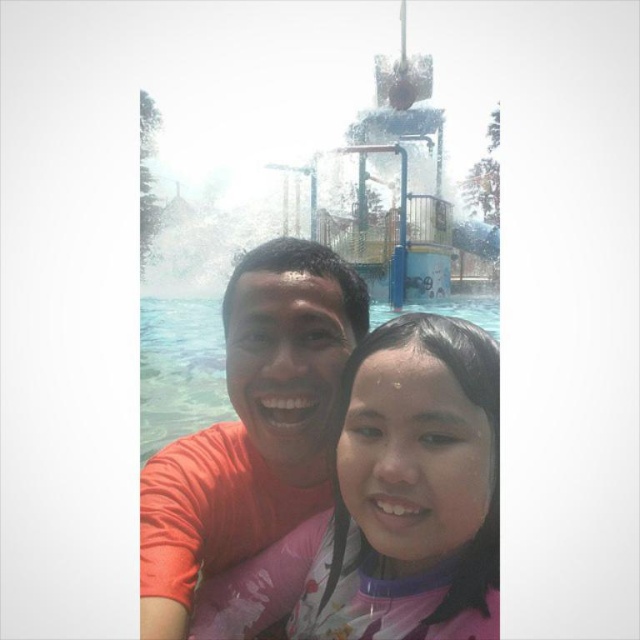
Is pink fabric at center below transparent plastic water at center?

Indeed, pink fabric at center is positioned under transparent plastic water at center.

Is point (316, 618) more distant than point (147, 429)?

That is False.

Locate an element on the screen. The image size is (640, 640). pink fabric at center is located at coordinates (390, 504).

Which of these two, pink fabric at center or orange matte shirt at center, stands taller?

With more height is orange matte shirt at center.

Looking at this image, does pink fabric at center have a lesser width compared to orange matte shirt at center?

No, pink fabric at center is not thinner than orange matte shirt at center.

Which is in front, point (490, 636) or point (282, 436)?

Point (490, 636) is in front.

You are a GUI agent. You are given a task and a screenshot of the screen. Output one action in this format:
    pyautogui.click(x=<x>, y=<y>)
    Task: Click on the pink fabric at center
    The image size is (640, 640).
    Given the screenshot: What is the action you would take?
    pyautogui.click(x=390, y=504)

Who is positioned more to the left, orange matte shirt at center or transparent plastic water at center?

orange matte shirt at center is more to the left.

The width and height of the screenshot is (640, 640). What are the coordinates of `orange matte shirt at center` in the screenshot? It's located at (252, 426).

This screenshot has height=640, width=640. I want to click on orange matte shirt at center, so click(252, 426).